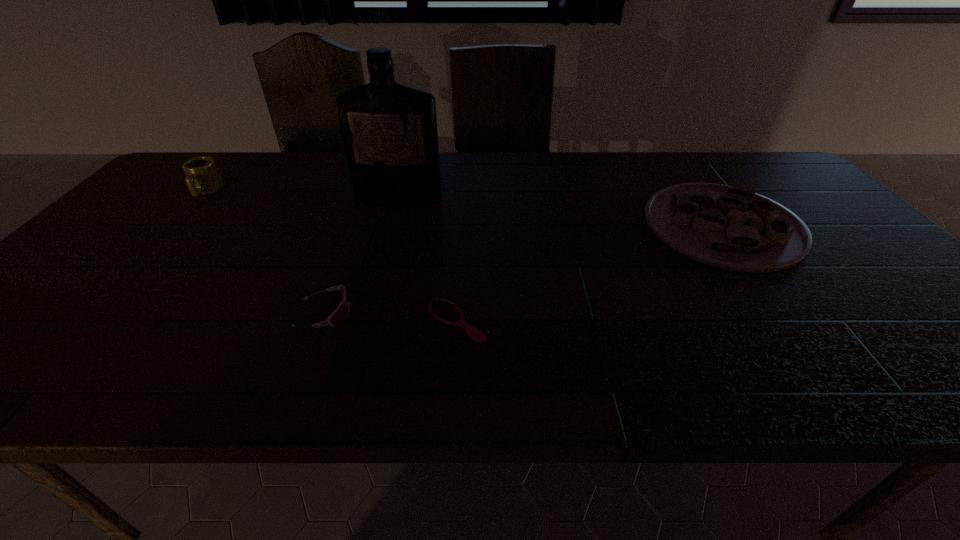
The image size is (960, 540). What are the coordinates of `liquor` in the screenshot? It's located at (389, 130).

Find the location of a particular element. The width and height of the screenshot is (960, 540). the fourth shortest object is located at coordinates point(202,175).

You are a GUI agent. You are given a task and a screenshot of the screen. Output one action in this format:
    pyautogui.click(x=<x>, y=<y>)
    Task: Click on the leftmost object
    
    Given the screenshot: What is the action you would take?
    pyautogui.click(x=202, y=175)

Locate an element on the screen. The height and width of the screenshot is (540, 960). the rightmost object is located at coordinates (733, 228).

Where is `the third shortest object`? the third shortest object is located at coordinates (733, 228).

The image size is (960, 540). What are the coordinates of `goggles` in the screenshot? It's located at point(341,312).

Identify the location of the shortest object. (446, 312).

Find the location of a particular element. The image size is (960, 540). the second object from right to left is located at coordinates (446, 312).

Where is `free region located on the label side of the liquor`? The width and height of the screenshot is (960, 540). free region located on the label side of the liquor is located at coordinates (380, 269).

At what (x,y) coordinates should I click in order to perform the action: click on free spot located with the handle on the side of the fourth shortest object. Please return your answer as a coordinate pair (x, y). Image resolution: width=960 pixels, height=540 pixels. Looking at the image, I should click on (122, 284).